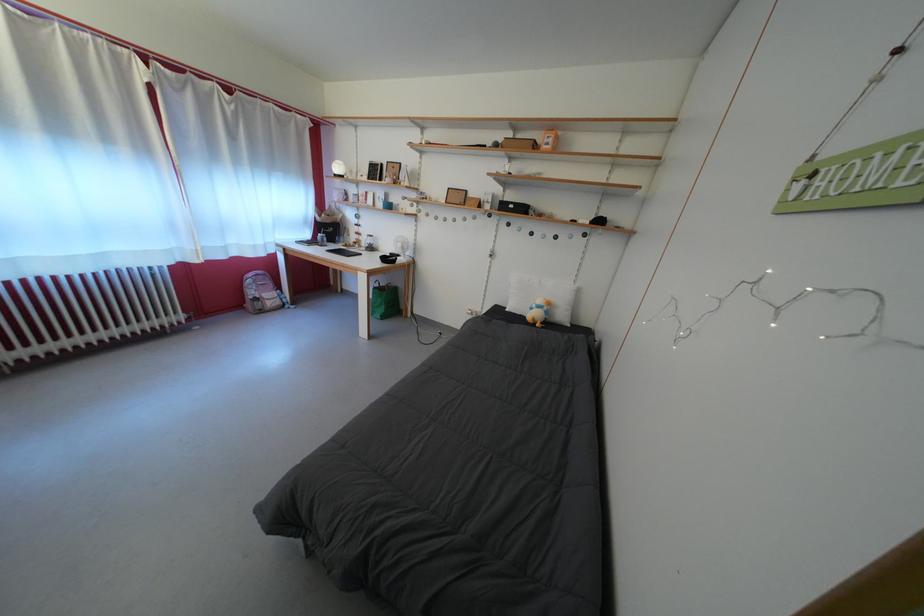
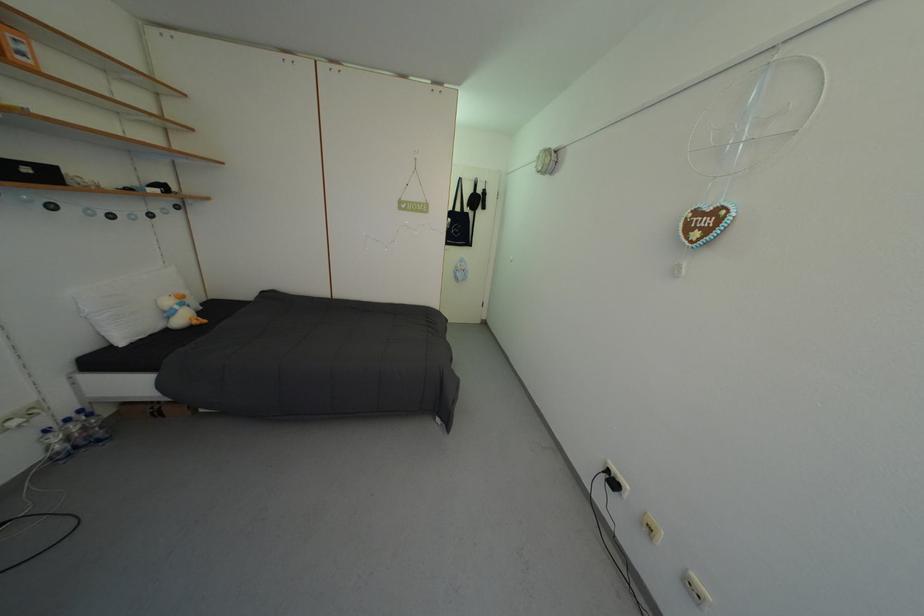
The point at [542,312] is marked in the first image. Where is the corresponding point in the second image?

(186, 313)